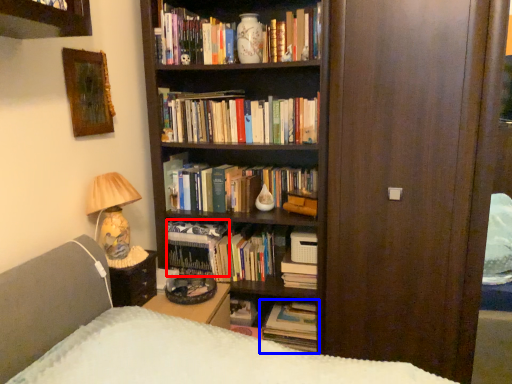
Question: Which point is further to the camera, book (highlighted by a red box) or book (highlighted by a blue box)?

Choices:
 (A) book
 (B) book

Answer: (A)